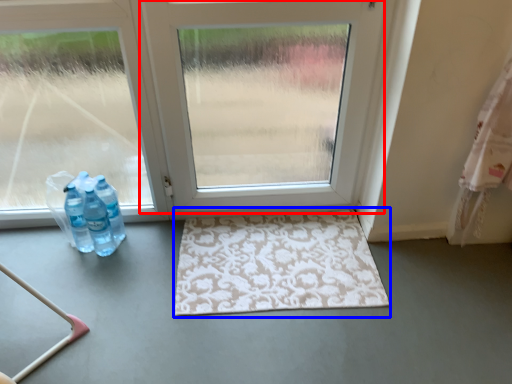
Question: Among these objects, which one is nearest to the camera, door (highlighted by a red box) or bath mat (highlighted by a blue box)?

Choices:
 (A) door
 (B) bath mat

Answer: (A)